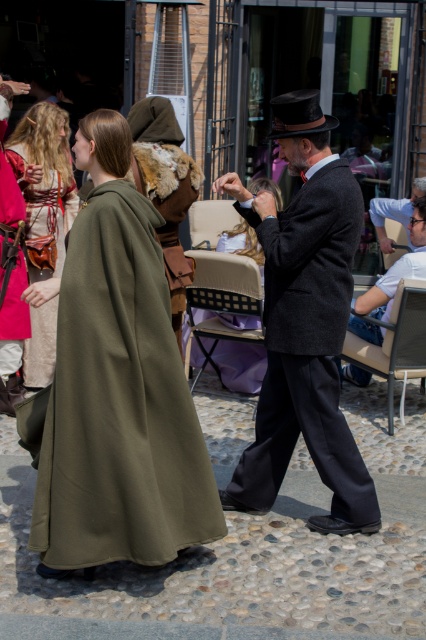
Question: Among these points, which one is farthest from the camera?

Choices:
 (A) (51, 154)
 (B) (377, 342)
 (C) (419, 193)
 (D) (319, 298)

Answer: (C)

Question: Does olive woolen cape at center come in front of smooth gray suit at center?

Choices:
 (A) no
 (B) yes

Answer: (B)

Question: Is olive woolen cape at center in front of matte green cloak at left?

Choices:
 (A) yes
 (B) no

Answer: (A)

Question: Is dark gray wool suit at center bigger than matte green cloak at left?

Choices:
 (A) no
 (B) yes

Answer: (B)

Question: Which of the following is the farthest from the observer?

Choices:
 (A) dark gray wool suit at center
 (B) olive woolen cape at center

Answer: (A)

Question: Which of the following is the closest to the observer?

Choices:
 (A) matte green cloak at left
 (B) dark gray wool suit at center
 (C) light blue shirt at right

Answer: (B)